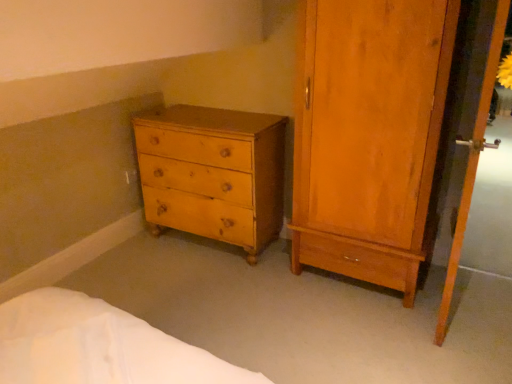
Question: Is wooden screen door at right bigger than matte wood wardrobe at right?

Choices:
 (A) no
 (B) yes

Answer: (A)

Question: From a real-world perspective, is wooden screen door at right beneath matte wood wardrobe at right?

Choices:
 (A) no
 (B) yes

Answer: (B)

Question: Does wooden screen door at right have a greater width compared to matte wood wardrobe at right?

Choices:
 (A) yes
 (B) no

Answer: (B)

Question: Considering the relative sizes of wooden screen door at right and matte wood wardrobe at right in the image provided, is wooden screen door at right shorter than matte wood wardrobe at right?

Choices:
 (A) no
 (B) yes

Answer: (B)

Question: From a real-world perspective, is wooden screen door at right on top of matte wood wardrobe at right?

Choices:
 (A) no
 (B) yes

Answer: (A)

Question: In terms of width, does light brown wood chest of drawers at lower left look wider or thinner when compared to wooden screen door at right?

Choices:
 (A) thin
 (B) wide

Answer: (B)

Question: Based on their sizes in the image, would you say light brown wood chest of drawers at lower left is bigger or smaller than wooden screen door at right?

Choices:
 (A) small
 (B) big

Answer: (B)

Question: From a real-world perspective, is light brown wood chest of drawers at lower left above or below wooden screen door at right?

Choices:
 (A) below
 (B) above

Answer: (A)

Question: Is point (279, 218) positioned closer to the camera than point (495, 21)?

Choices:
 (A) farther
 (B) closer

Answer: (A)

Question: Is matte wood wardrobe at right taller or shorter than light brown wood chest of drawers at lower left?

Choices:
 (A) tall
 (B) short

Answer: (A)

Question: Would you say matte wood wardrobe at right is inside or outside light brown wood chest of drawers at lower left?

Choices:
 (A) outside
 (B) inside

Answer: (A)

Question: From a real-world perspective, is matte wood wardrobe at right above or below light brown wood chest of drawers at lower left?

Choices:
 (A) below
 (B) above

Answer: (B)

Question: In the image, is matte wood wardrobe at right positioned in front of or behind light brown wood chest of drawers at lower left?

Choices:
 (A) front
 (B) behind

Answer: (A)

Question: In the image, is matte wood wardrobe at right positioned in front of or behind wooden screen door at right?

Choices:
 (A) front
 (B) behind

Answer: (B)

Question: Considering the positions of matte wood wardrobe at right and wooden screen door at right in the image, is matte wood wardrobe at right taller or shorter than wooden screen door at right?

Choices:
 (A) short
 (B) tall

Answer: (B)